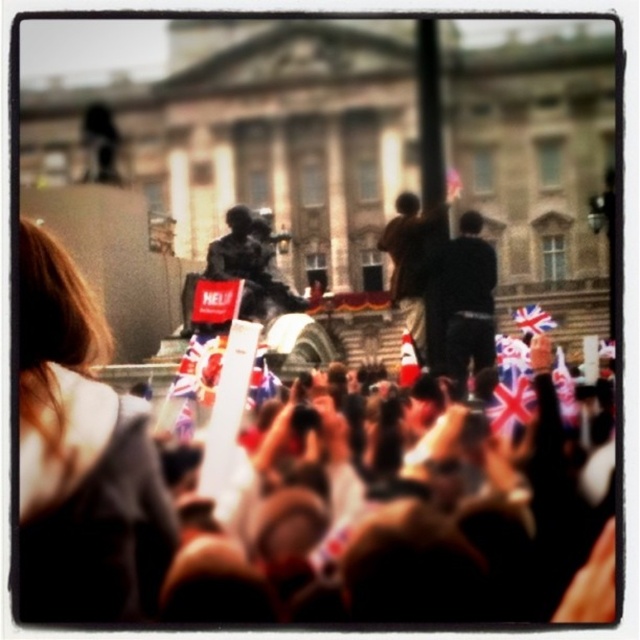
Question: From the image, what is the correct spatial relationship of brown textured fabric at center in relation to brown fabric at left?

Choices:
 (A) above
 (B) below

Answer: (B)

Question: Which of the following is the farthest from the observer?

Choices:
 (A) brown textured fabric at center
 (B) dark brown leather jacket at center

Answer: (B)

Question: Which object is farther from the camera taking this photo?

Choices:
 (A) brown fabric at left
 (B) brown textured fabric at center
 (C) dark brown leather jacket at center

Answer: (C)

Question: Is brown textured fabric at center to the left of brown fabric at left from the viewer's perspective?

Choices:
 (A) yes
 (B) no

Answer: (B)

Question: Which object is the closest to the brown textured fabric at center?

Choices:
 (A) brown fabric at left
 (B) dark brown leather jacket at center

Answer: (B)

Question: Observing the image, what is the correct spatial positioning of brown textured fabric at center in reference to dark brown leather jacket at center?

Choices:
 (A) below
 (B) above

Answer: (A)